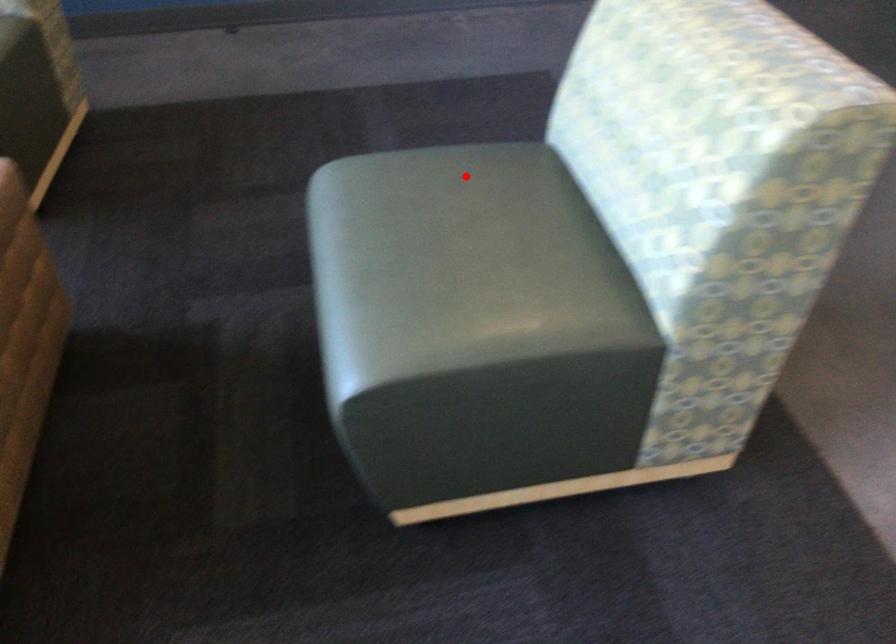
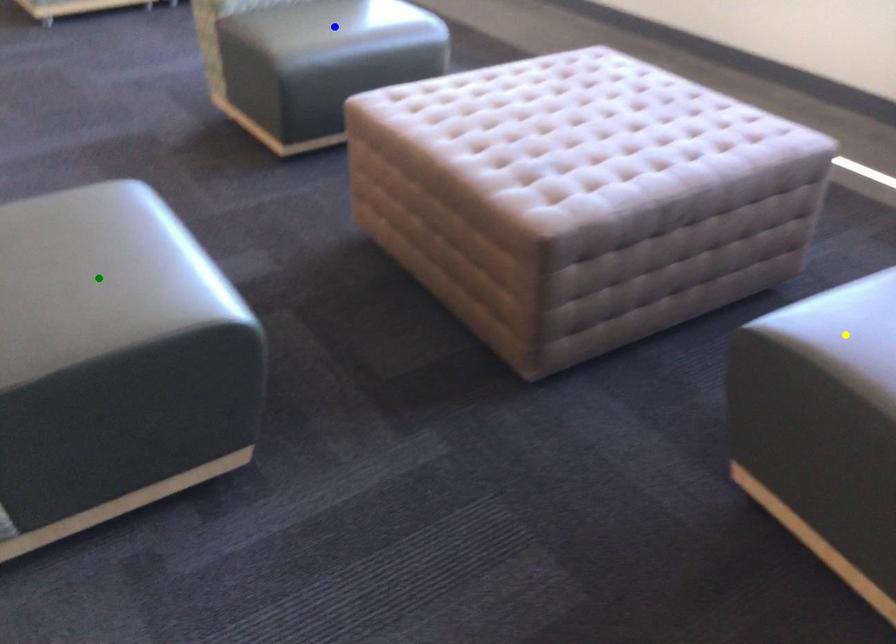
Question: I am providing you with two images of the same scene from different viewpoints. A red point is marked on the first image. You are given multiple points on the second image. Which point in image 2 is actually the same real-world point as the red point in image 1?

Choices:
 (A) yellow point
 (B) green point
 (C) blue point

Answer: (B)